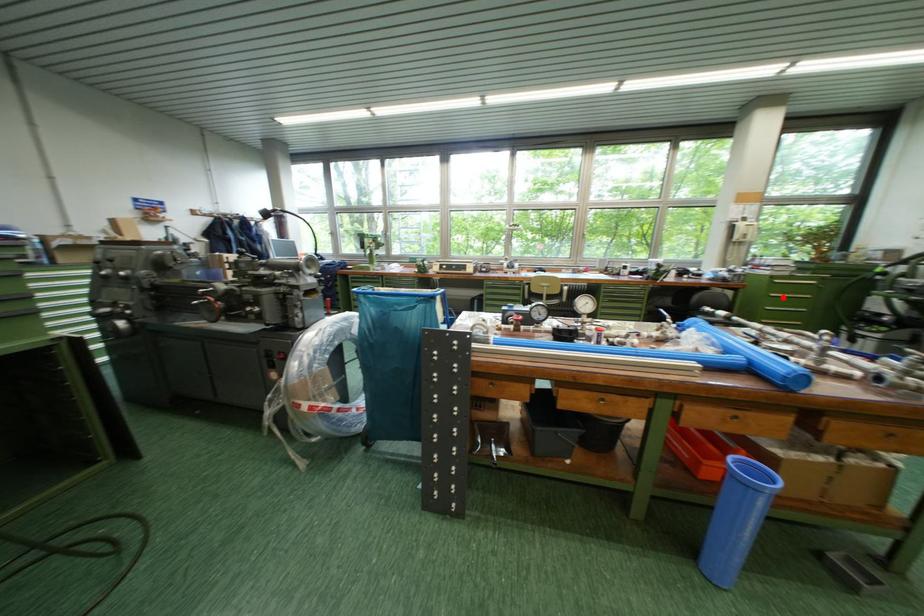
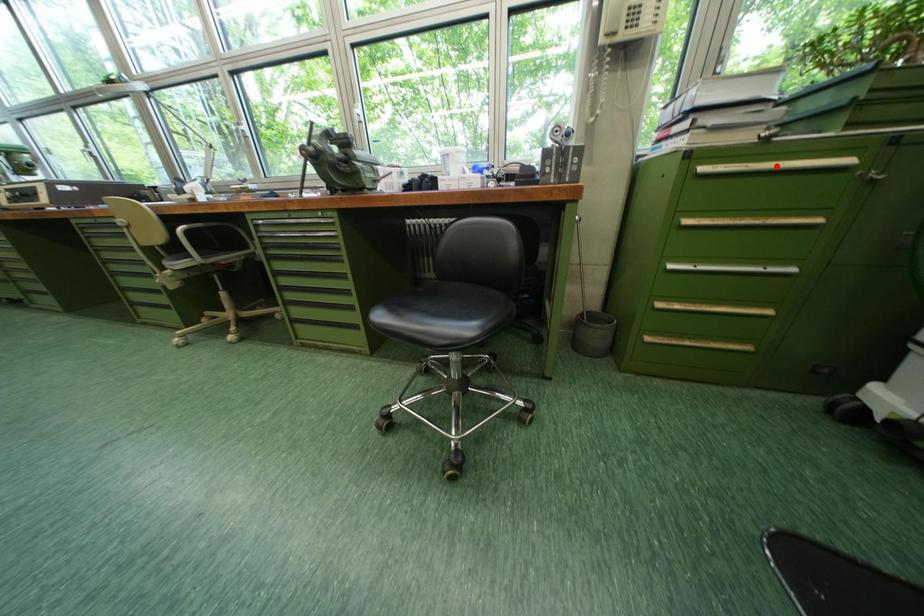
I am providing you with two images of the same scene from different viewpoints. A red point is marked on the first image and another point is marked on the second image. Is the red point in image1 aligned with the point shown in image2?

No